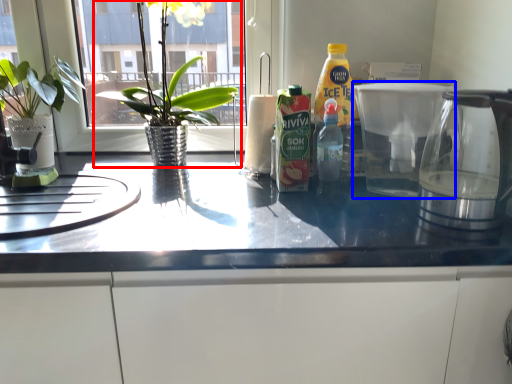
Question: Which point is further to the camera, houseplant (highlighted by a red box) or coffeepot (highlighted by a blue box)?

Choices:
 (A) houseplant
 (B) coffeepot

Answer: (A)